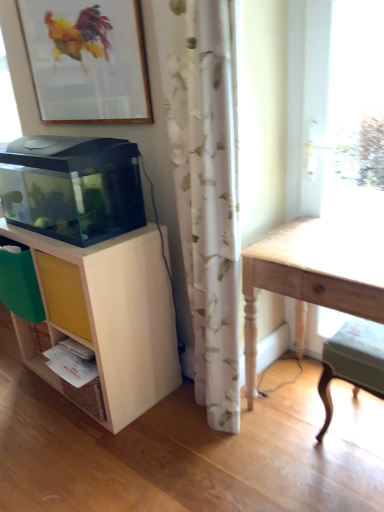
This screenshot has height=512, width=384. Find the location of `empty space that is ontop of light wood table at right (from a real-world perspective)`. empty space that is ontop of light wood table at right (from a real-world perspective) is located at coordinates (336, 242).